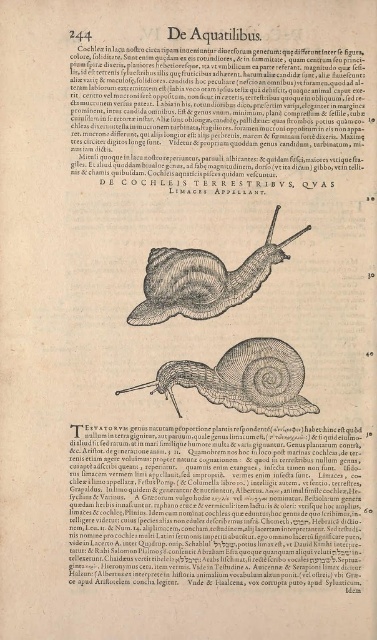
You are a photographer holding a camera. You want to take a picture of the matte black snail at center from a distance of exactly 5 feet. Can you do so without moving the snail?

Yes, because the matte black snail at center and the camera are already 5.00 feet apart, so you can take the picture from that distance without moving the snail.